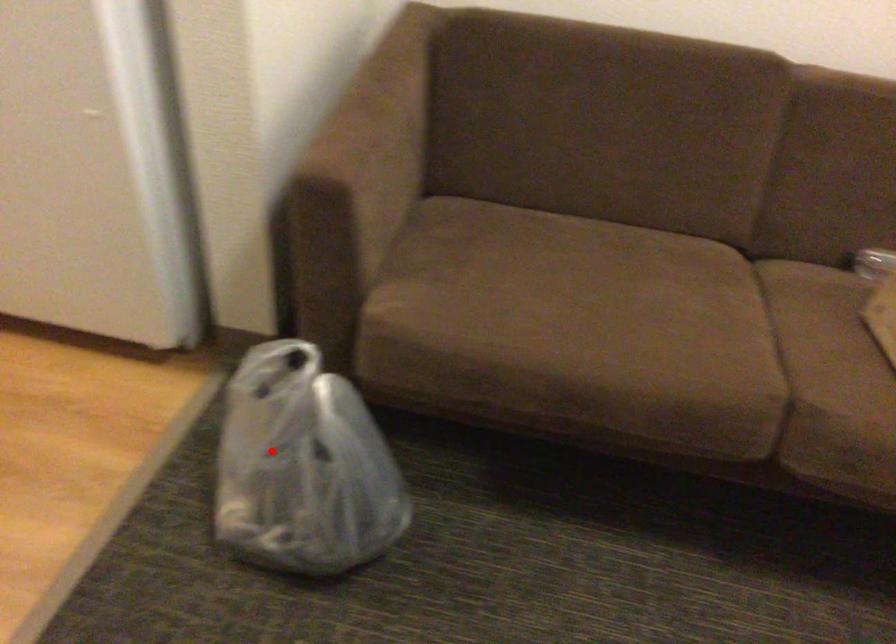
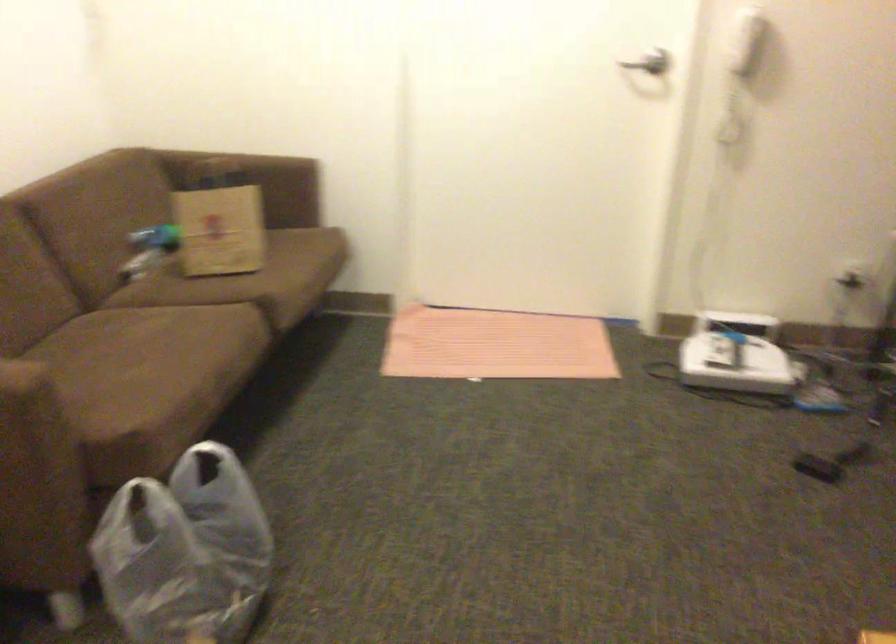
Question: I am providing you with two images of the same scene from different viewpoints. Given a red point in image1, look at the same physical point in image2. Is it:

Choices:
 (A) Closer to the viewpoint
 (B) Farther from the viewpoint

Answer: (B)